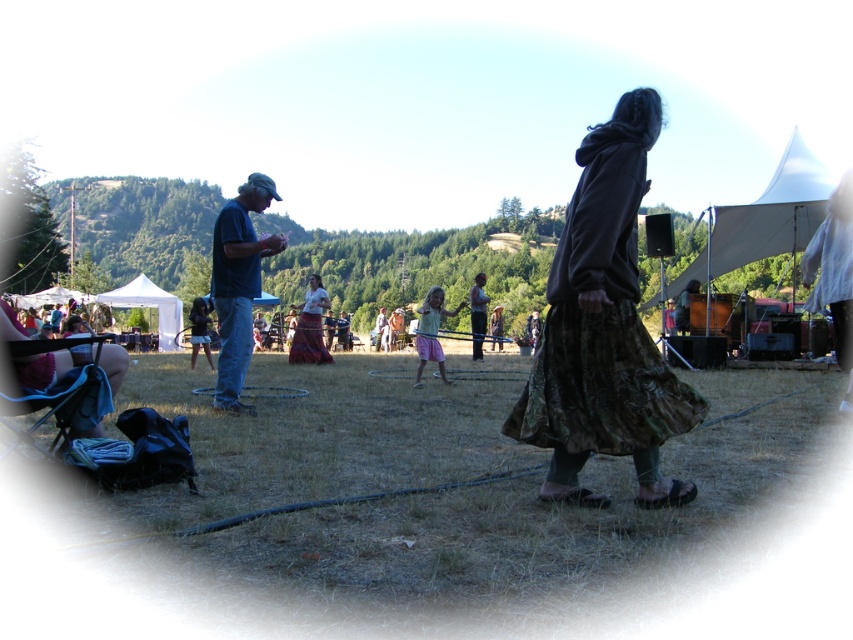
Between dark brown textured coat at right and multicolored fabric skirt at center, which one is positioned higher?

Positioned higher is dark brown textured coat at right.

Between point (643, 176) and point (294, 346), which one is positioned in front?

Point (643, 176) is more forward.

The height and width of the screenshot is (640, 853). Identify the location of dark brown textured coat at right. (604, 330).

Can you confirm if dark blue t-shirt at center is thinner than camouflage fabric skirt at center?

No.

Is dark blue t-shirt at center in front of camouflage fabric skirt at center?

That is True.

What do you see at coordinates (238, 284) in the screenshot? I see `dark blue t-shirt at center` at bounding box center [238, 284].

Locate an element on the screen. The width and height of the screenshot is (853, 640). dark blue t-shirt at center is located at coordinates (238, 284).

Is point (460, 301) closer to camera compared to point (428, 353)?

No.

Is point (439, 288) behind point (422, 344)?

Yes, it is behind point (422, 344).

The width and height of the screenshot is (853, 640). Identify the location of pink fabric skirt at center. (431, 332).